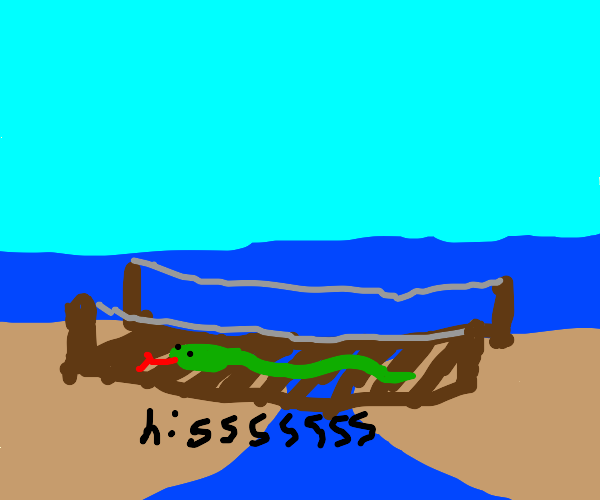
This screenshot has width=600, height=500. I want to click on snake picture, so click(x=276, y=368).